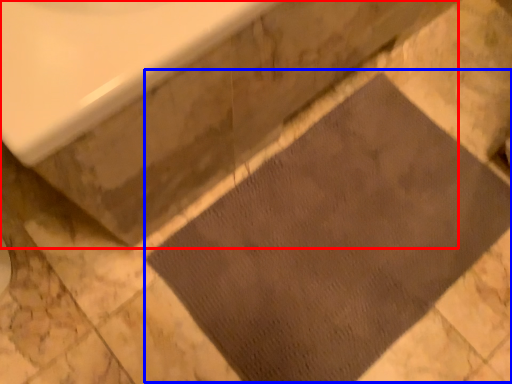
Question: Which point is closer to the camera, bath (highlighted by a red box) or doormat (highlighted by a blue box)?

Choices:
 (A) bath
 (B) doormat

Answer: (A)